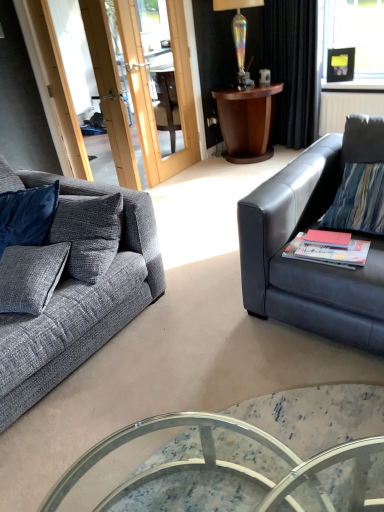
You are a GUI agent. You are given a task and a screenshot of the screen. Output one action in this format:
    pyautogui.click(x=<x>, y=<y>)
    Task: Click on the empty space that is ontop of matte red book at right, acting as the second book starting from the right (from a real-world perspective)
    This screenshot has width=384, height=512.
    Given the screenshot: What is the action you would take?
    pyautogui.click(x=333, y=239)